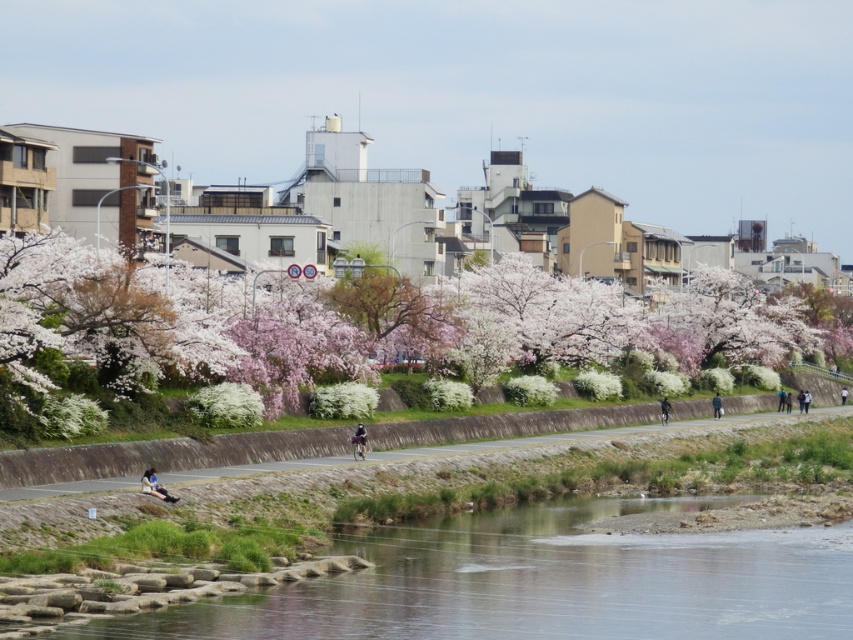
Looking at this image, which of these two, matte black jacket at lower left or light blue fabric person at center-right, stands taller?

With more height is light blue fabric person at center-right.

Does matte black jacket at lower left have a greater height compared to light blue fabric person at center-right?

No, matte black jacket at lower left is not taller than light blue fabric person at center-right.

Which is in front, point (143, 477) or point (842, 390)?

Positioned in front is point (143, 477).

The width and height of the screenshot is (853, 640). Find the location of `matte black jacket at lower left`. matte black jacket at lower left is located at coordinates (154, 486).

Can you confirm if clear water at river right is shorter than white blossoms at center?

Yes.

Between clear water at river right and white blossoms at center, which one is positioned higher?

white blossoms at center

Which is in front, point (634, 584) or point (184, 280)?

Point (634, 584)

Where is `clear water at river right`? Image resolution: width=853 pixels, height=640 pixels. clear water at river right is located at coordinates (543, 582).

Is dark blue fabric jacket at center to the right of black matte bicycle at center-right from the viewer's perspective?

No, dark blue fabric jacket at center is not to the right of black matte bicycle at center-right.

The height and width of the screenshot is (640, 853). What are the coordinates of `dark blue fabric jacket at center` in the screenshot? It's located at (358, 442).